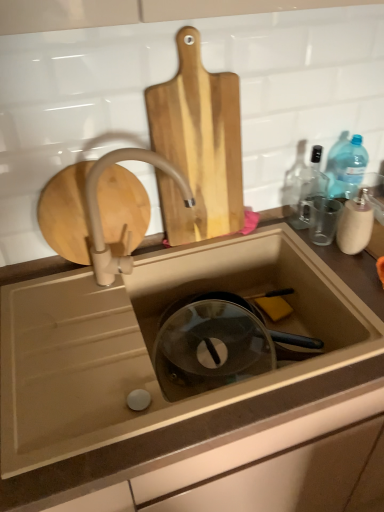
The image size is (384, 512). What are the coordinates of `vacant area to the right of natural wood cutting board at upper center` in the screenshot? It's located at (263, 236).